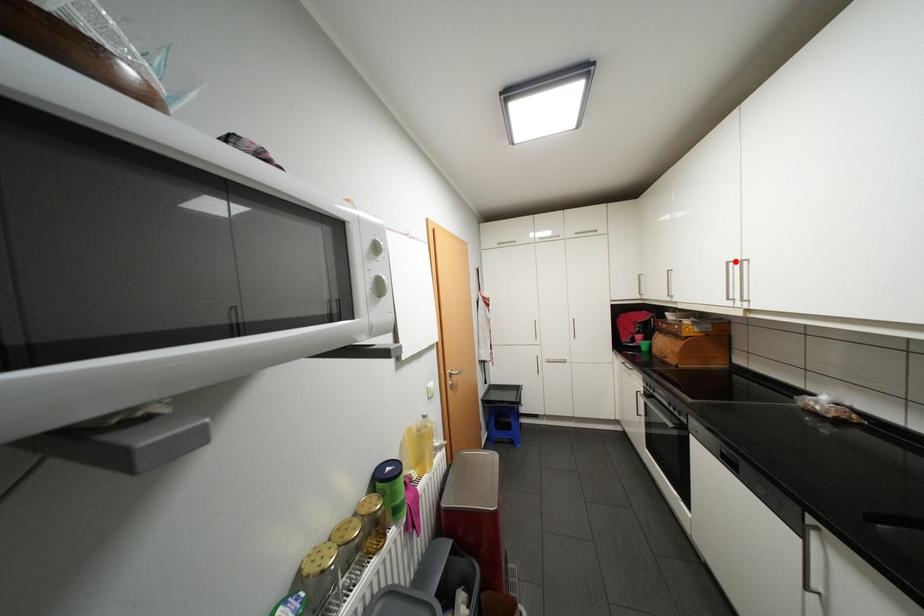
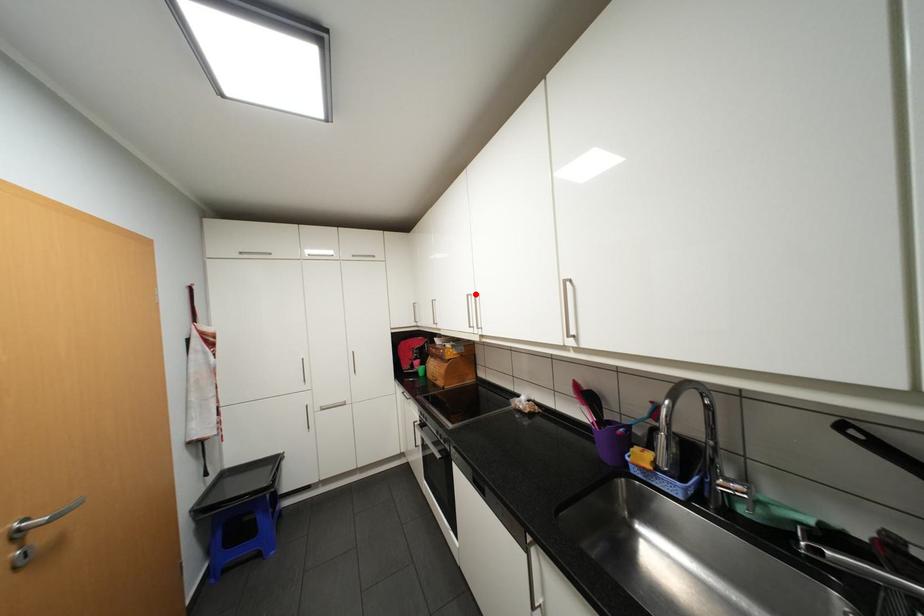
I am providing you with two images of the same scene from different viewpoints. A red point is marked on the first image and another point is marked on the second image. Do the highlighted points in image1 and image2 indicate the same real-world spot?

Yes